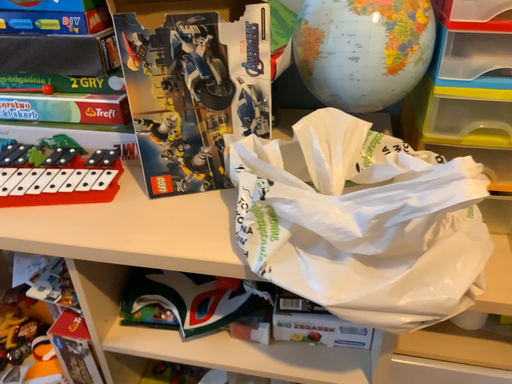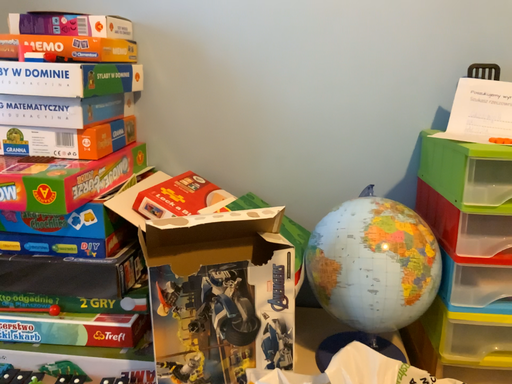
Question: How did the camera likely rotate when shooting the video?

Choices:
 (A) rotated downward
 (B) rotated upward

Answer: (B)